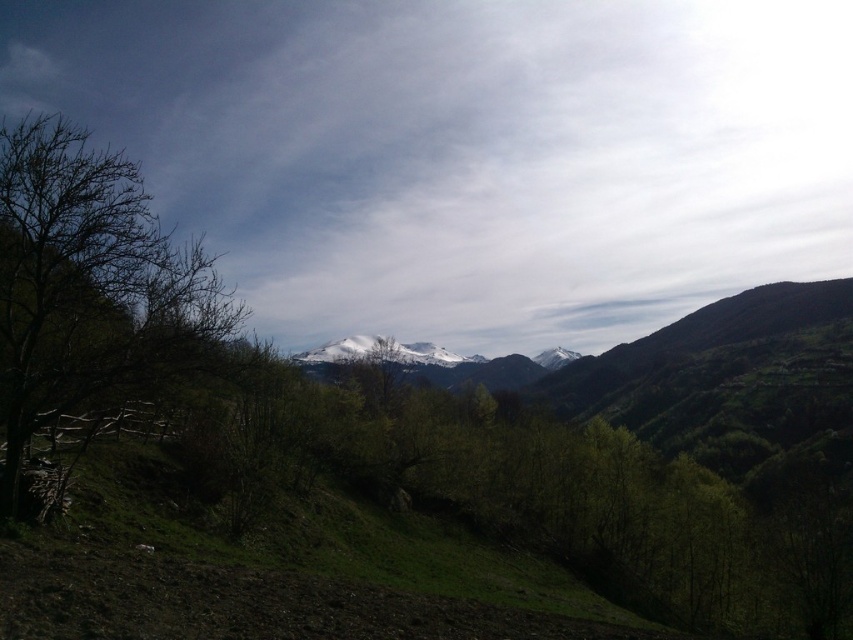
You are standing in the mountain landscape and want to determine which of the two points, point (4,304) or point (526,374), is closer to you. Based on the scene description, which point is nearer?

Point (4,304) is closer to the viewer than point (526,374).

You are standing at the point marked as point (90,285) in the image. What type of terrain or feature are you currently standing on?

You are standing on bare branches at left as indicated by the point (90,285).